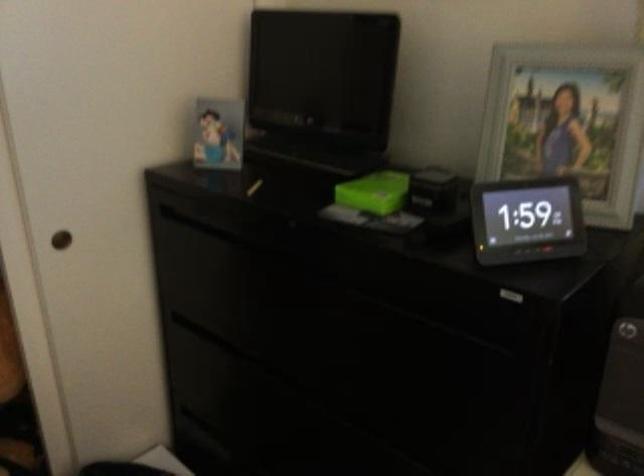
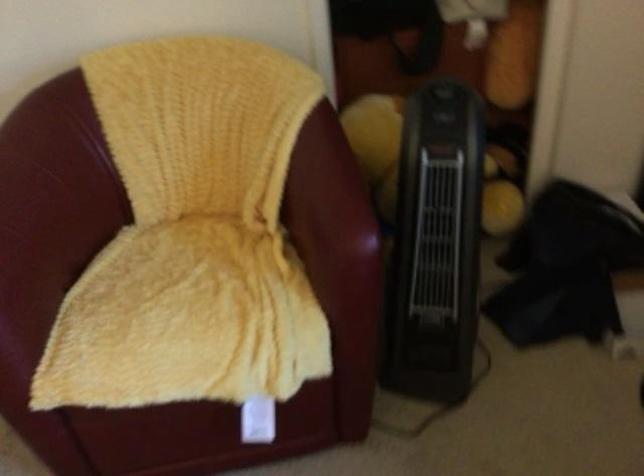
The images are taken continuously from a first-person perspective. In which direction is your viewpoint rotating?

The camera rotated toward left-down.